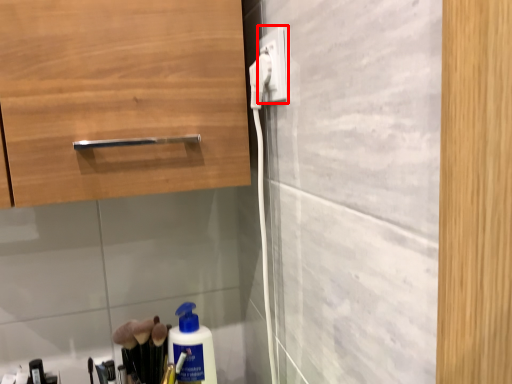
Question: Observing the image, what is the correct spatial positioning of electric outlet (annotated by the red box) in reference to electric outlet?

Choices:
 (A) left
 (B) right

Answer: (B)